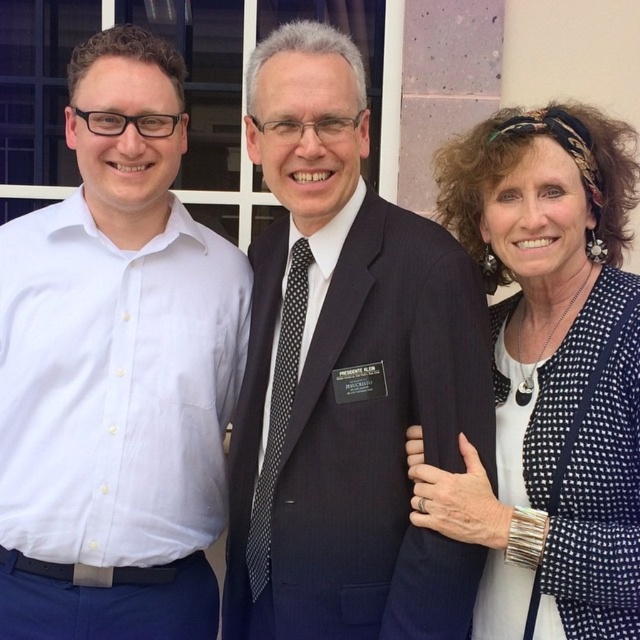
Question: Does white cotton shirt at left appear on the right side of dark blue textured suit at center?

Choices:
 (A) no
 (B) yes

Answer: (A)

Question: Which of the following is the farthest from the observer?

Choices:
 (A) dark blue textured suit at center
 (B) white dotted cardigan at center

Answer: (A)

Question: Does white cotton shirt at left come in front of dark blue textured suit at center?

Choices:
 (A) no
 (B) yes

Answer: (A)

Question: Which point is closer to the camera?

Choices:
 (A) white dotted cardigan at center
 (B) dark blue textured suit at center
 (C) white cotton shirt at left

Answer: (A)

Question: Is white cotton shirt at left behind white dotted cardigan at center?

Choices:
 (A) no
 (B) yes

Answer: (B)

Question: Which point is farther from the camera taking this photo?

Choices:
 (A) (477, 214)
 (B) (131, 474)
 (C) (460, 620)

Answer: (A)